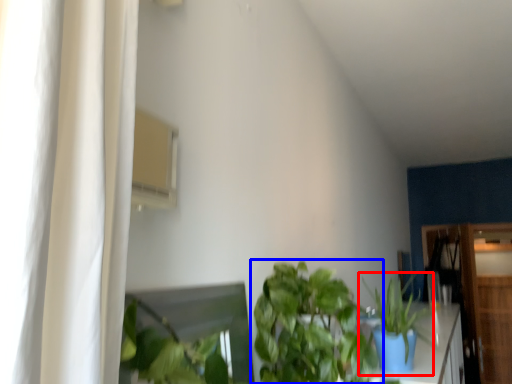
Question: Which of the following is the closest to the observer, houseplant (highlighted by a red box) or houseplant (highlighted by a blue box)?

Choices:
 (A) houseplant
 (B) houseplant

Answer: (B)